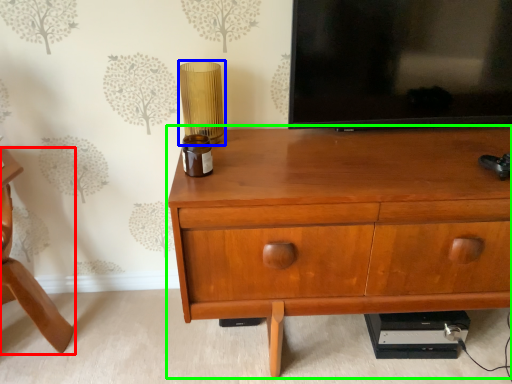
Question: Which object is positioned closest to furniture (highlighted by a red box)? Select from table lamp (highlighted by a blue box) and chest of drawers (highlighted by a green box).

Choices:
 (A) table lamp
 (B) chest of drawers

Answer: (A)